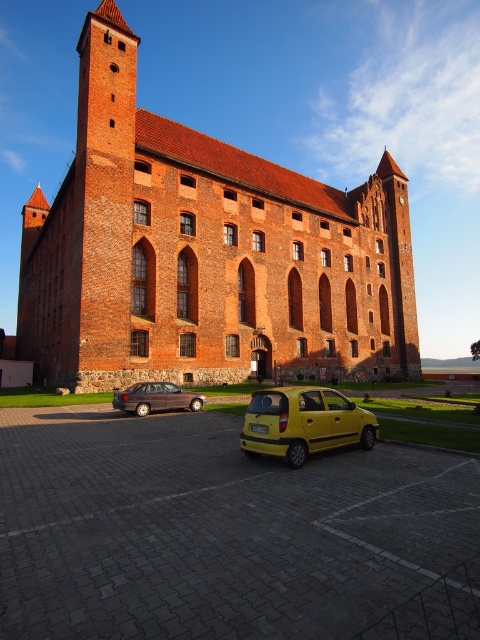
The image size is (480, 640). What do you see at coordinates (204, 252) in the screenshot? I see `brick building at center` at bounding box center [204, 252].

Between brick building at center and yellow matte taxi at lower center, which one appears on the left side from the viewer's perspective?

Positioned to the left is brick building at center.

Image resolution: width=480 pixels, height=640 pixels. What do you see at coordinates (204, 252) in the screenshot? I see `brick building at center` at bounding box center [204, 252].

At what (x,y) coordinates should I click in order to perform the action: click on brick building at center. Please return your answer as a coordinate pair (x, y). The image size is (480, 640). Looking at the image, I should click on (204, 252).

Is yellow matte taxi at lower center to the right of matte black sedan at lower left from the viewer's perspective?

Yes, yellow matte taxi at lower center is to the right of matte black sedan at lower left.

Find the location of a particular element. This screenshot has height=640, width=480. yellow matte taxi at lower center is located at coordinates (303, 422).

You are a GUI agent. You are given a task and a screenshot of the screen. Output one action in this format:
    pyautogui.click(x=<x>, y=<y>)
    Task: Click on the yellow matte taxi at lower center
    Image resolution: width=480 pixels, height=640 pixels.
    Given the screenshot: What is the action you would take?
    pyautogui.click(x=303, y=422)

Can you confirm if yellow plastic car at lower center is positioned to the right of yellow matte taxi at lower center?

Incorrect, yellow plastic car at lower center is not on the right side of yellow matte taxi at lower center.

Can you confirm if yellow plastic car at lower center is positioned to the left of yellow matte taxi at lower center?

Correct, you'll find yellow plastic car at lower center to the left of yellow matte taxi at lower center.

Where is `yellow plastic car at lower center`? The height and width of the screenshot is (640, 480). yellow plastic car at lower center is located at coordinates (214, 529).